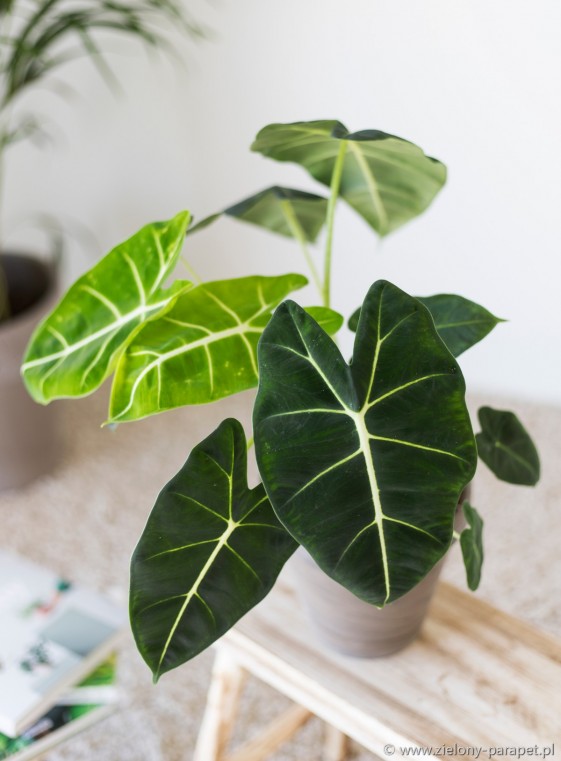
The image size is (561, 761). Identify the location of books/magazines. (58, 667), (77, 709).